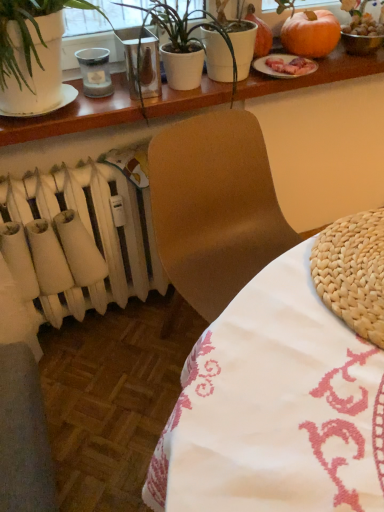
This screenshot has height=512, width=384. In order to click on free point to the left of metallic glass vase at upper center in this screenshot , I will do `click(88, 109)`.